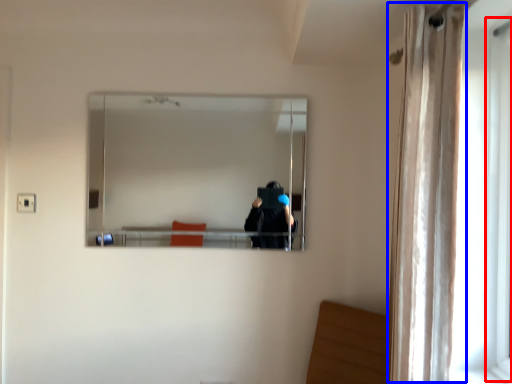
Question: Which point is closer to the camera, screen door (highlighted by a red box) or curtain (highlighted by a blue box)?

Choices:
 (A) screen door
 (B) curtain

Answer: (B)